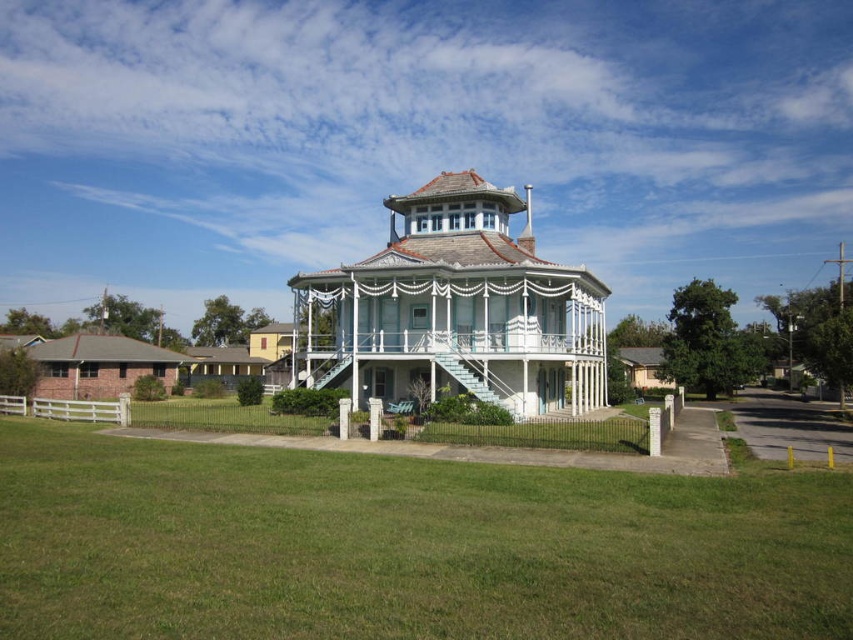
You are planning to host a small garden party and want to place a large table and chairs in the garden. The table is too heavy to move once placed. Based on the image, can you determine if the white painted wood gazebo at center is a suitable location for the table and chairs, considering the space available under the gazebo compared to the white painted wood porch at center?

The white painted wood gazebo at center is positioned over white painted wood porch at center, meaning the porch is underneath it. Since the gazebo is above the porch, placing the table and chairs under the gazebo would be feasible as it likely provides sufficient covered space. However, the porch itself may also offer space, but the gazebo is the better choice due to its elevated structure offering protection from weather.

You are a gardener who needs to mow the lawn. You see the green grass at center and the white painted wood gazebo at center. Which area requires mowing, and why?

The green grass at center requires mowing because it has a lesser height compared to the white painted wood gazebo at center, indicating it needs trimming.

You are standing in front of the Victorian house and want to walk towards the white painted wood gazebo at center. Which direction should you walk to avoid the green grass at center?

You should walk to the left side of the white painted wood gazebo at center since the green grass at center is on its right side.